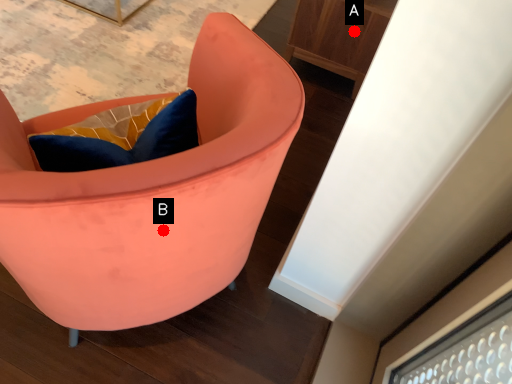
Question: Two points are circled on the image, labeled by A and B beside each circle. Among these points, which one is nearest to the camera?

Choices:
 (A) A is closer
 (B) B is closer

Answer: (B)